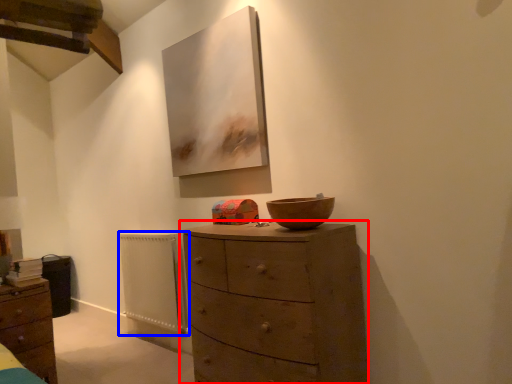
Question: Which object appears farthest to the camera in this image, chest of drawers (highlighted by a red box) or radiator (highlighted by a blue box)?

Choices:
 (A) chest of drawers
 (B) radiator

Answer: (B)